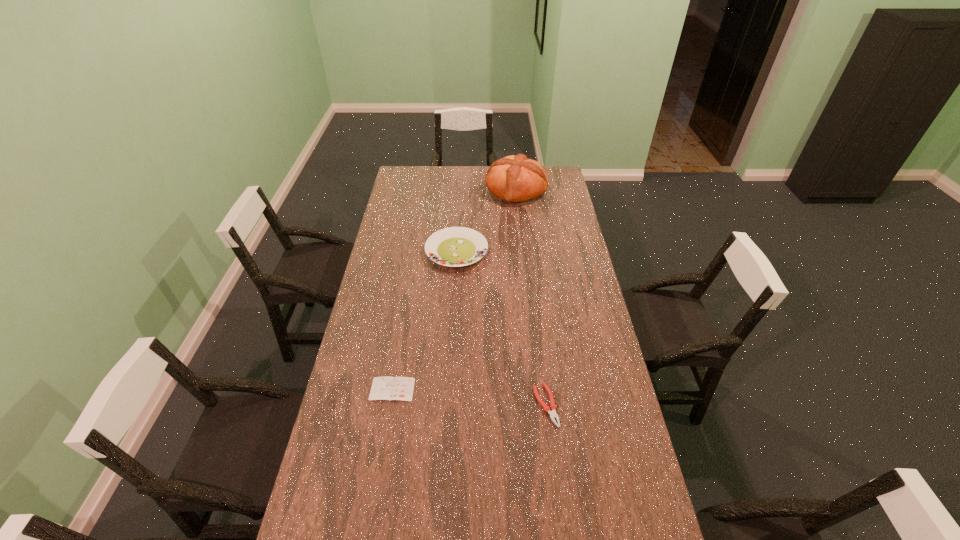
Where is `free space in the image that satisfies the following two spatial constraints: 1. on the back side of the tallest object; 2. on the left side of the third nearest object`? The height and width of the screenshot is (540, 960). free space in the image that satisfies the following two spatial constraints: 1. on the back side of the tallest object; 2. on the left side of the third nearest object is located at coordinates (461, 190).

Where is `free spot that satisfies the following two spatial constraints: 1. on the front side of the pliers; 2. on the left side of the bread`? The width and height of the screenshot is (960, 540). free spot that satisfies the following two spatial constraints: 1. on the front side of the pliers; 2. on the left side of the bread is located at coordinates (540, 406).

The height and width of the screenshot is (540, 960). What are the coordinates of `vacant space that satisfies the following two spatial constraints: 1. on the front side of the diary; 2. on the left side of the pliers` in the screenshot? It's located at (390, 406).

The height and width of the screenshot is (540, 960). Identify the location of free spot that satisfies the following two spatial constraints: 1. on the front side of the shortest object; 2. on the left side of the third tallest object. (390, 406).

The height and width of the screenshot is (540, 960). In order to click on vacant area that satisfies the following two spatial constraints: 1. on the back side of the diary; 2. on the left side of the bread in this screenshot , I will do `click(425, 190)`.